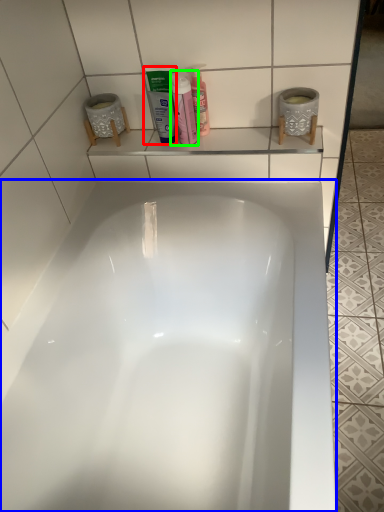
Question: Which object is positioned closest to mouthwash (highlighted by a red box)? Select from bathtub (highlighted by a blue box) and cleaning product (highlighted by a green box).

Choices:
 (A) bathtub
 (B) cleaning product

Answer: (B)